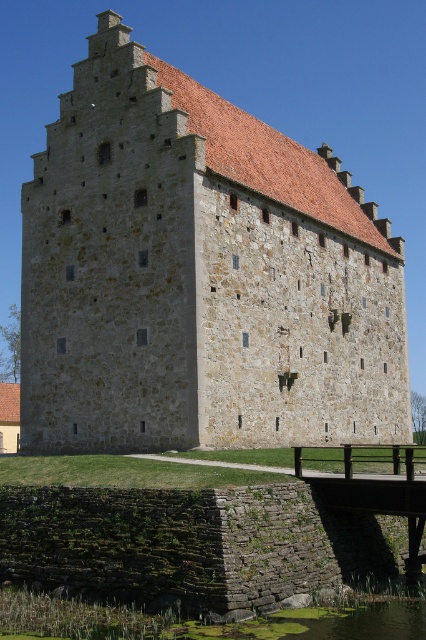
Question: Which point is farther to the camera?

Choices:
 (A) (207, 342)
 (B) (368, 614)
 (C) (367, 448)

Answer: (C)

Question: Which point is closer to the camera?

Choices:
 (A) stone brick castle at center
 (B) green mossy water at lower center

Answer: (B)

Question: Does stone brick castle at center have a smaller size compared to green mossy water at lower center?

Choices:
 (A) no
 (B) yes

Answer: (A)

Question: Can you confirm if stone brick castle at center is wider than brown wooden bridge at lower center?

Choices:
 (A) no
 (B) yes

Answer: (B)

Question: Can you confirm if green mossy water at lower center is smaller than brown wooden bridge at lower center?

Choices:
 (A) yes
 (B) no

Answer: (A)

Question: Considering the real-world distances, which object is closest to the stone brick castle at center?

Choices:
 (A) green mossy water at lower center
 (B) brown wooden bridge at lower center

Answer: (B)